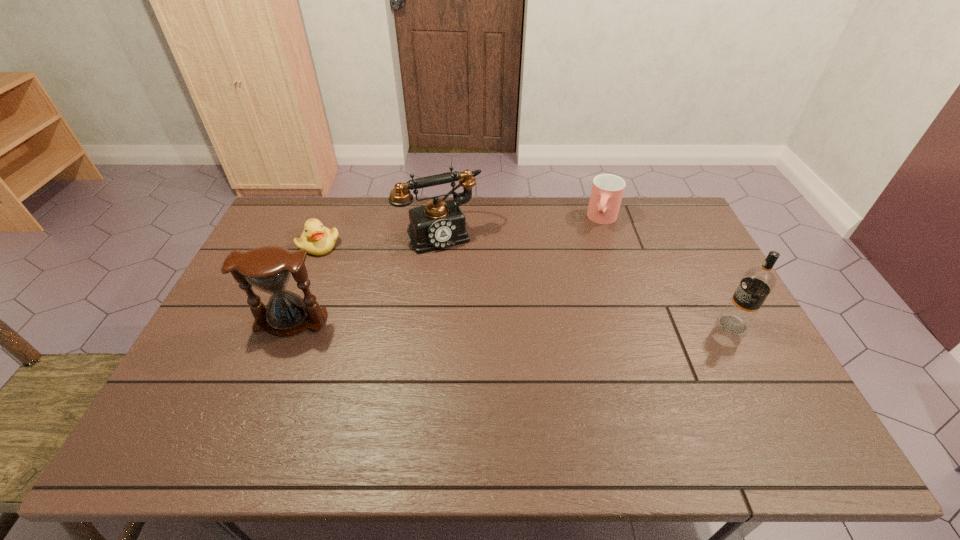
The height and width of the screenshot is (540, 960). What are the coordinates of `hourglass` in the screenshot? It's located at (268, 268).

The height and width of the screenshot is (540, 960). Find the location of `the rightmost object`. the rightmost object is located at coordinates (757, 283).

Identify the location of the shortest object. (316, 239).

Locate an element on the screen. telephone is located at coordinates (439, 224).

The width and height of the screenshot is (960, 540). I want to click on the second object from right to left, so click(x=607, y=191).

Locate an element on the screen. This screenshot has width=960, height=540. the second shortest object is located at coordinates (607, 191).

Find the location of `free spot located on the right of the hourglass`. free spot located on the right of the hourglass is located at coordinates click(x=354, y=321).

Find the location of a particular element. free space located on the label of the rightmost object is located at coordinates (664, 325).

Identify the location of vacant space situated on the label of the rightmost object. (668, 325).

At what (x,y) coordinates should I click in order to perform the action: click on vacant space situated 0.240m on the label of the rightmost object. Please return your answer as a coordinate pair (x, y). The image size is (960, 540). Looking at the image, I should click on (633, 325).